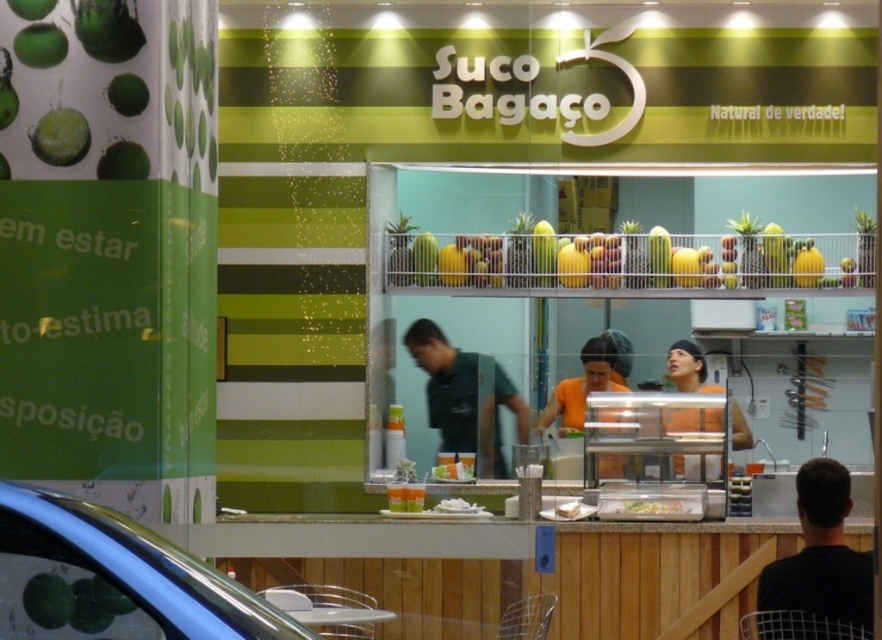
Which is more to the left, green matte pineapple at upper left or white paper plate at center?

From the viewer's perspective, green matte pineapple at upper left appears more on the left side.

Measure the distance between point [71,163] and camera.

A distance of 4.88 meters exists between point [71,163] and camera.

Is point (86, 144) positioned behind point (559, 512)?

No.

The height and width of the screenshot is (640, 882). In order to click on green matte pineapple at upper left in this screenshot , I will do `click(60, 136)`.

How distant is yellow matte pineapple at center from orange fabric shirt at center?

35.51 inches

Does yellow matte pineapple at center have a larger size compared to orange fabric shirt at center?

Yes, yellow matte pineapple at center is bigger than orange fabric shirt at center.

Locate an element on the screen. This screenshot has height=640, width=882. yellow matte pineapple at center is located at coordinates (632, 259).

Is orange fabric shirt at center below translucent plastic tray at center?

Actually, orange fabric shirt at center is above translucent plastic tray at center.

What do you see at coordinates (688, 369) in the screenshot?
I see `orange fabric shirt at center` at bounding box center [688, 369].

Where is `orange fabric shirt at center`? orange fabric shirt at center is located at coordinates (688, 369).

At what (x,y) coordinates should I click in order to perform the action: click on orange fabric shirt at center. Please return your answer as a coordinate pair (x, y). This screenshot has width=882, height=640. Looking at the image, I should click on (688, 369).